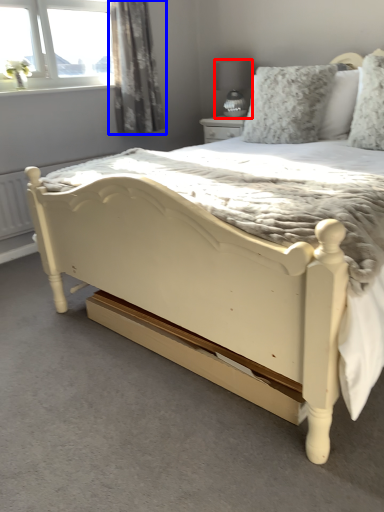
Question: Which object is closer to the camera taking this photo, lamp (highlighted by a red box) or curtain (highlighted by a blue box)?

Choices:
 (A) lamp
 (B) curtain

Answer: (B)